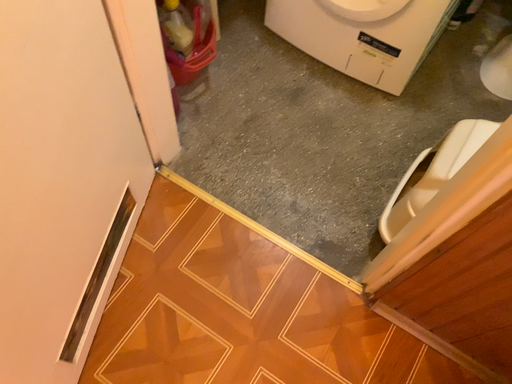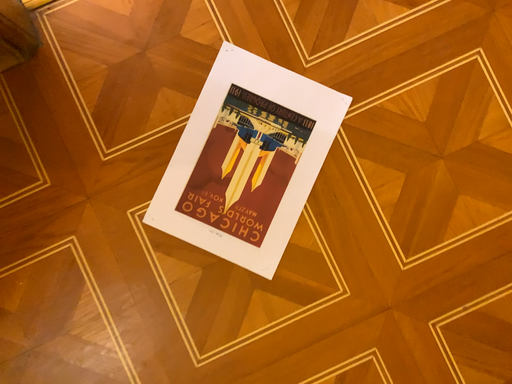
Question: Which way did the camera rotate in the video?

Choices:
 (A) rotated upward
 (B) rotated downward

Answer: (A)